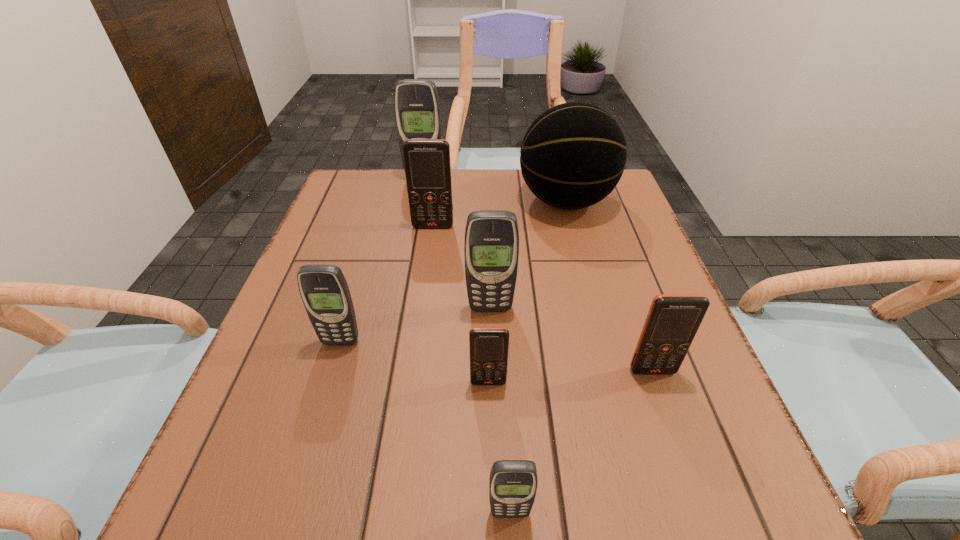
Identify the location of orange cellular telephone that stands as the second closest to the leftmost orange cellular telephone. (673, 320).